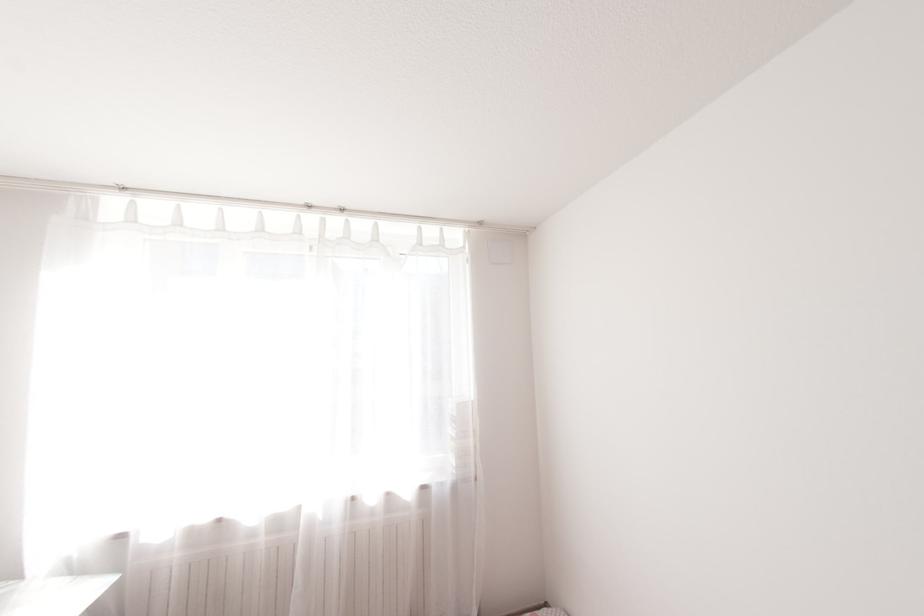
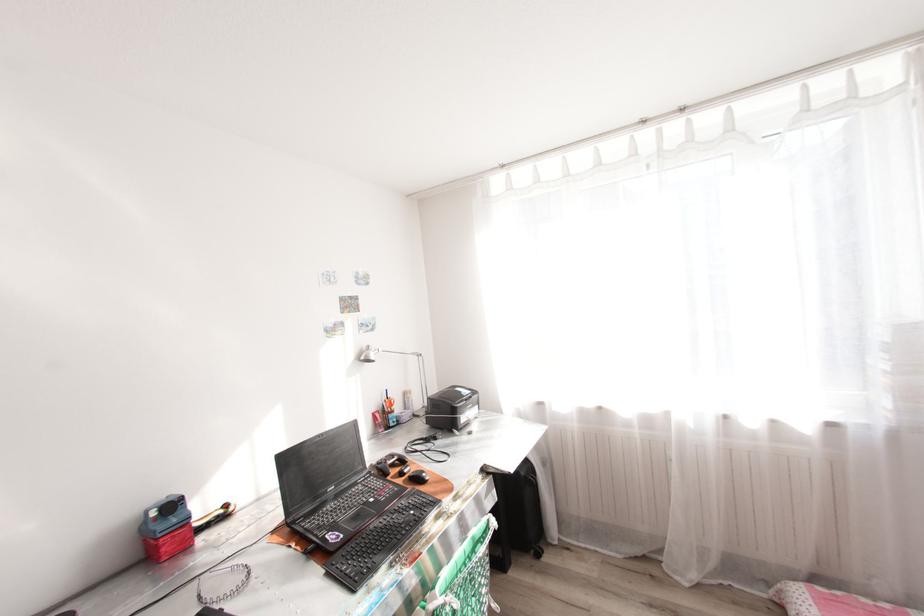
Question: The first image is from the beginning of the video and the second image is from the end. How did the camera likely rotate when shooting the video?

Choices:
 (A) Left
 (B) Right
 (C) Up
 (D) Down

Answer: (A)